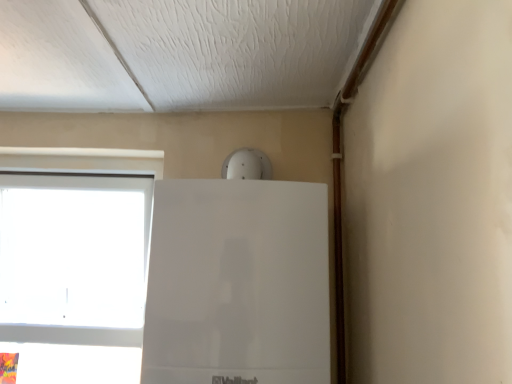
Describe the element at coordinates (237, 283) in the screenshot. I see `white glossy fridge at upper center` at that location.

What are the coordinates of `white glossy fridge at upper center` in the screenshot? It's located at (237, 283).

Locate an element on the screen. white plastic window at left is located at coordinates (75, 262).

Describe the element at coordinates (75, 262) in the screenshot. The height and width of the screenshot is (384, 512). I see `white plastic window at left` at that location.

Locate an element on the screen. Image resolution: width=512 pixels, height=384 pixels. white glossy fridge at upper center is located at coordinates (237, 283).

Which object is positioned more to the left, white glossy fridge at upper center or white plastic window at left?

From the viewer's perspective, white plastic window at left appears more on the left side.

Looking at this image, which object is further away from the camera taking this photo, white glossy fridge at upper center or white plastic window at left?

white plastic window at left is further from the camera.

Considering the points (220, 236) and (127, 243), which point is in front, point (220, 236) or point (127, 243)?

Point (220, 236)

From the image's perspective, is white glossy fridge at upper center over white plastic window at left?

Indeed, from the image's perspective, white glossy fridge at upper center is shown above white plastic window at left.

From a real-world perspective, between white glossy fridge at upper center and white plastic window at left, who is vertically lower?

In real-world perspective, white plastic window at left is lower.

In terms of width, does white glossy fridge at upper center look wider or thinner when compared to white plastic window at left?

In the image, white glossy fridge at upper center appears to be wider than white plastic window at left.

Does white glossy fridge at upper center have a greater height compared to white plastic window at left?

No, white glossy fridge at upper center is not taller than white plastic window at left.

Based on the photo, between white glossy fridge at upper center and white plastic window at left, which one has larger size?

white plastic window at left is bigger.

Is white glossy fridge at upper center outside of white plastic window at left?

white glossy fridge at upper center lies outside white plastic window at left's area.

Is white glossy fridge at upper center beside white plastic window at left?

white glossy fridge at upper center and white plastic window at left are clearly separated.

Is white plastic window at left at the back of white glossy fridge at upper center?

That's not correct — white glossy fridge at upper center is not looking away from white plastic window at left.

Locate an element on the screen. The width and height of the screenshot is (512, 384). fridge positioned vertically above the white plastic window at left (from a real-world perspective) is located at coordinates (237, 283).

Is white plastic window at left at the right side of white glossy fridge at upper center?

Incorrect, white plastic window at left is not on the right side of white glossy fridge at upper center.

Which object is more forward, white plastic window at left or white glossy fridge at upper center?

white glossy fridge at upper center is more forward.

Does point (112, 220) come in front of point (211, 223)?

That is False.

From the image's perspective, between white plastic window at left and white glossy fridge at upper center, which one is located above?

white glossy fridge at upper center is shown above in the image.

From a real-world perspective, is white plastic window at left positioned under white glossy fridge at upper center based on gravity?

Yes, from a real-world perspective, white plastic window at left is under white glossy fridge at upper center.

Can you confirm if white plastic window at left is thinner than white glossy fridge at upper center?

Yes.

From their relative heights in the image, would you say white plastic window at left is taller or shorter than white glossy fridge at upper center?

In the image, white plastic window at left appears to be taller than white glossy fridge at upper center.

Is white plastic window at left bigger than white glossy fridge at upper center?

Yes, white plastic window at left is bigger than white glossy fridge at upper center.

Is white glossy fridge at upper center surrounded by white plastic window at left?

No.

Are white plastic window at left and white glossy fridge at upper center located far from each other?

That's not correct — white plastic window at left is a little close to white glossy fridge at upper center.

Could you tell me if white plastic window at left is facing white glossy fridge at upper center?

No, white plastic window at left is not aimed at white glossy fridge at upper center.

In order to click on fridge above the white plastic window at left (from the image's perspective) in this screenshot , I will do `click(237, 283)`.

Find the location of a particular element. The height and width of the screenshot is (384, 512). fridge above the white plastic window at left (from the image's perspective) is located at coordinates (237, 283).

Identify the location of fridge on the right of white plastic window at left. The height and width of the screenshot is (384, 512). (237, 283).